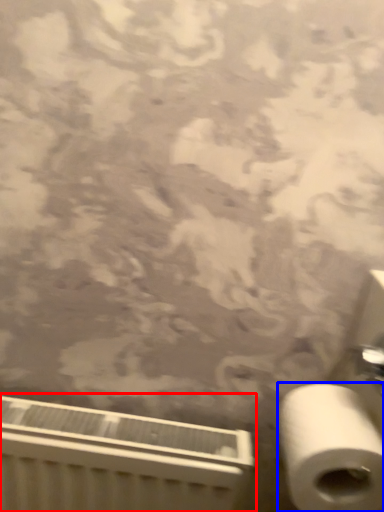
Question: Which of the following is the farthest to the observer, radiator (highlighted by a red box) or toilet paper (highlighted by a blue box)?

Choices:
 (A) radiator
 (B) toilet paper

Answer: (A)